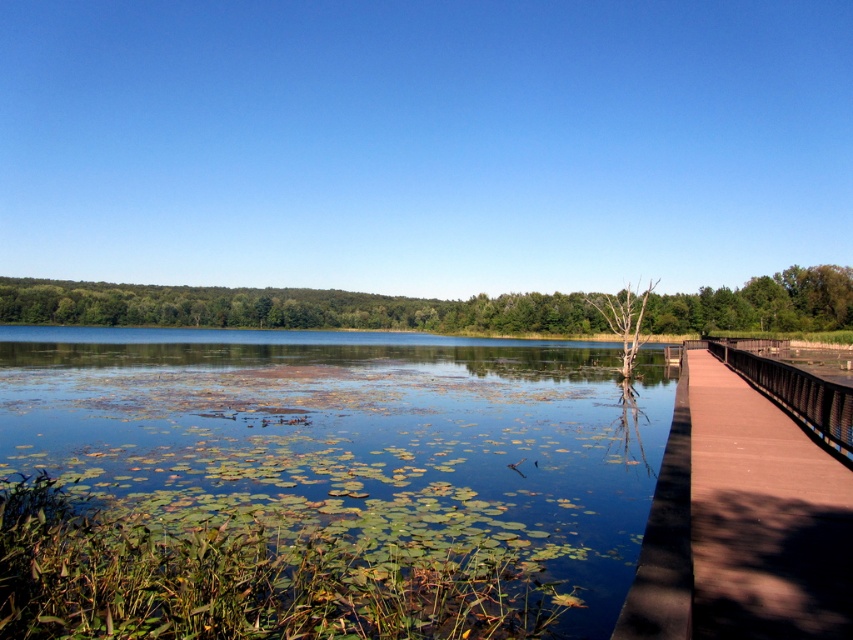
Question: Observing the image, what is the correct spatial positioning of green leafy water at center in reference to green leafy tree at center?

Choices:
 (A) right
 (B) left

Answer: (A)

Question: Which of the following is the farthest from the observer?

Choices:
 (A) (x=321, y=321)
 (B) (x=154, y=419)
 (C) (x=724, y=380)

Answer: (A)

Question: Which of the following is the closest to the observer?

Choices:
 (A) green leafy water at center
 (B) green leafy tree at center
 (C) brown wooden bridge at right

Answer: (C)

Question: Is green leafy water at center below green leafy tree at center?

Choices:
 (A) yes
 (B) no

Answer: (A)

Question: Which object is closer to the camera taking this photo?

Choices:
 (A) green leafy tree at center
 (B) green leafy water at center
 (C) brown wooden bridge at right

Answer: (C)

Question: In this image, where is green leafy water at center located relative to green leafy tree at center?

Choices:
 (A) below
 (B) above

Answer: (A)